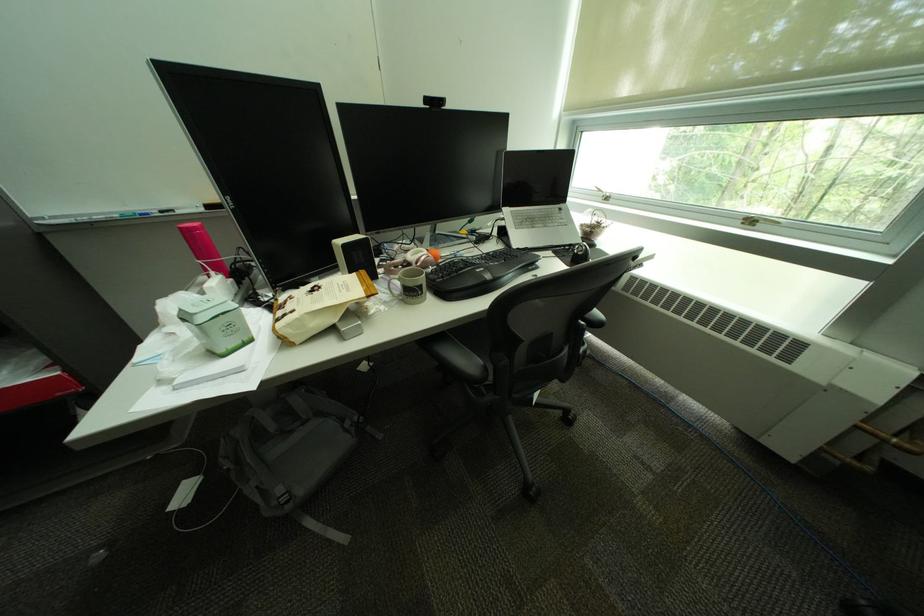
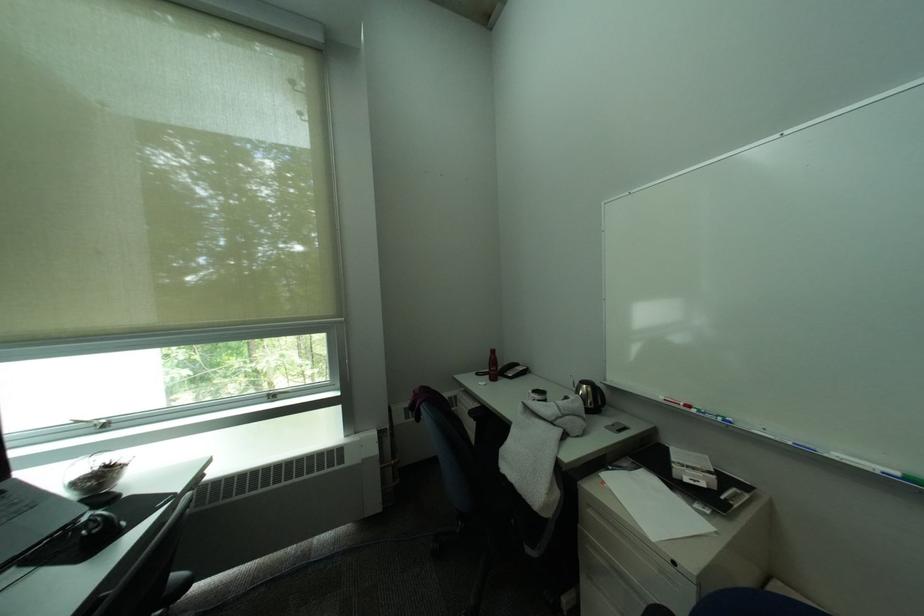
The point at (763, 217) is marked in the first image. Where is the corresponding point in the second image?

(283, 392)